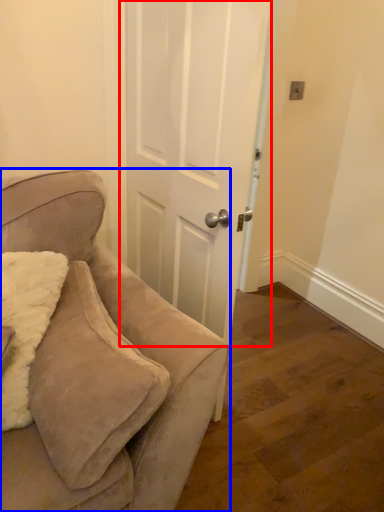
Question: Which point is closer to the camera, door (highlighted by a red box) or chair (highlighted by a blue box)?

Choices:
 (A) door
 (B) chair

Answer: (B)